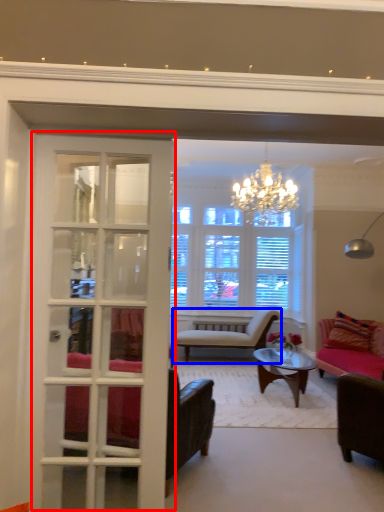
Question: Which of the following is the closest to the observer, door (highlighted by a red box) or chair (highlighted by a blue box)?

Choices:
 (A) door
 (B) chair

Answer: (A)